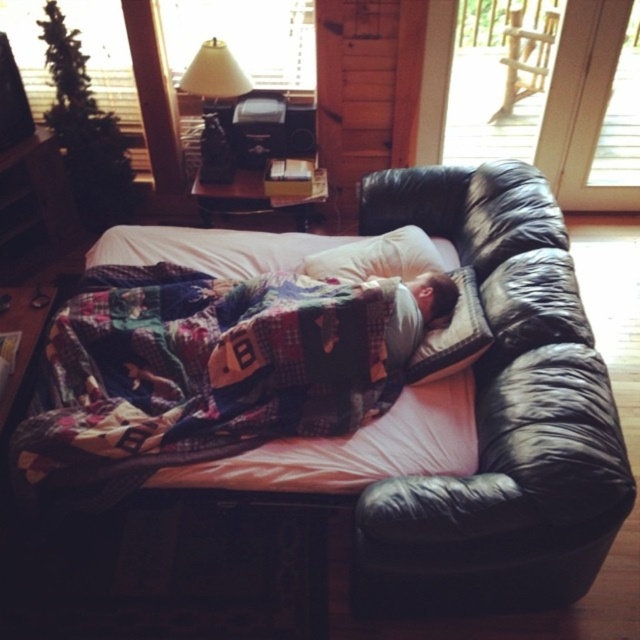
Question: Among these objects, which one is farthest from the camera?

Choices:
 (A) white soft pillow at upper center
 (B) matte black lamp at upper center
 (C) white soft pillow at center

Answer: (B)

Question: Is black leather couch at center above white soft pillow at upper center?

Choices:
 (A) yes
 (B) no

Answer: (B)

Question: Does white soft pillow at center lie in front of white soft pillow at upper center?

Choices:
 (A) yes
 (B) no

Answer: (B)

Question: Does black leather couch at center have a lesser width compared to quilted fabric blanket at center?

Choices:
 (A) no
 (B) yes

Answer: (A)

Question: Which object is farther from the camera taking this photo?

Choices:
 (A) black leather couch at center
 (B) white soft pillow at upper center
 (C) quilted fabric blanket at center

Answer: (B)

Question: Which of the following is the farthest from the observer?

Choices:
 (A) quilted fabric blanket at center
 (B) white soft pillow at upper center
 (C) white soft pillow at center

Answer: (C)